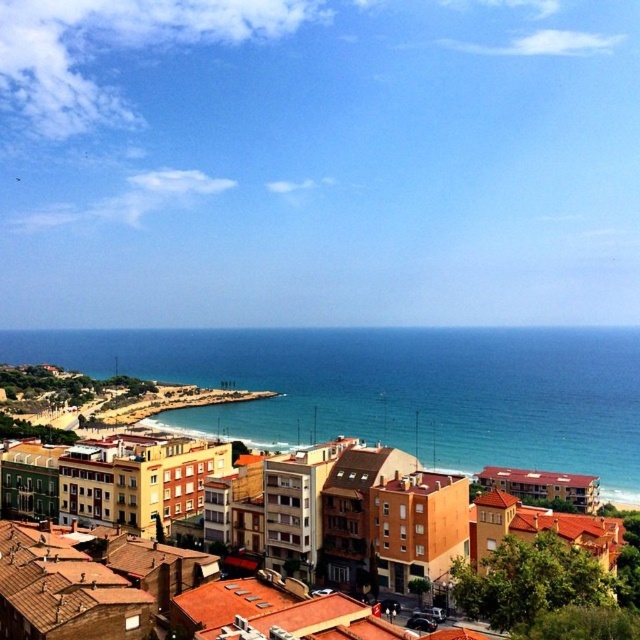
You are standing on the beach and want to take a photo of both the blue water at center and the brown matte building at center. Which object should you focus on first if you want both to be in clear focus?

You should focus on the brown matte building at center first because it is closer to you than the blue water at center. By focusing on the closer object, the farther one may still be in focus depending on the depth of field.

You are standing on the beach and see the blue water at center and the brown matte building at center. Which one is higher in the image?

The blue water at center is located above the brown matte building at center, so the blue water at center is higher in the image.

You are a tourist standing on the beach and want to take a photo that includes both the blue water at center and the brown matte building at center. Based on their widths, which one should you position closer to the edge of the frame to include both in the photo?

Since the blue water at center might be wider than the brown matte building at center, you should position the brown matte building at center closer to the edge of the frame to ensure both fit within the photo.